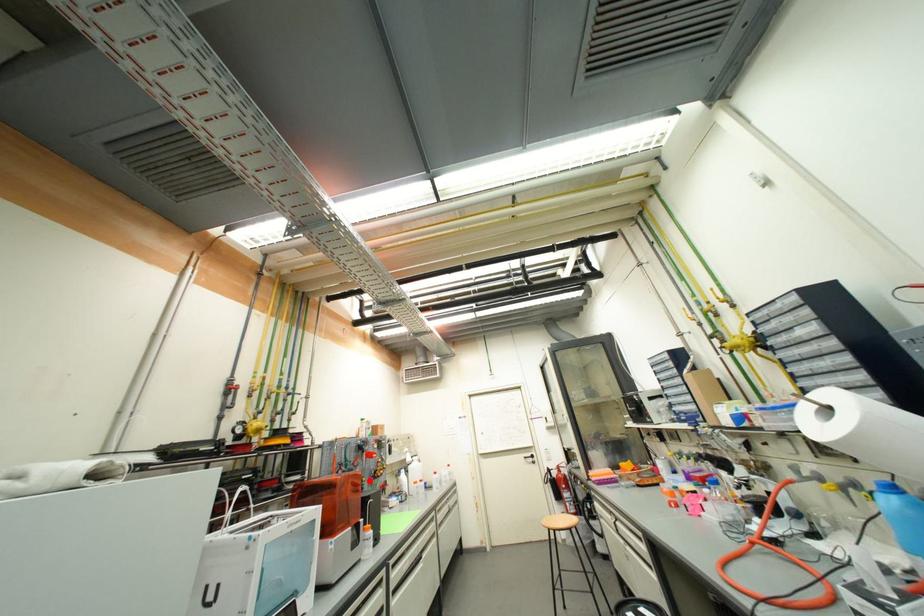
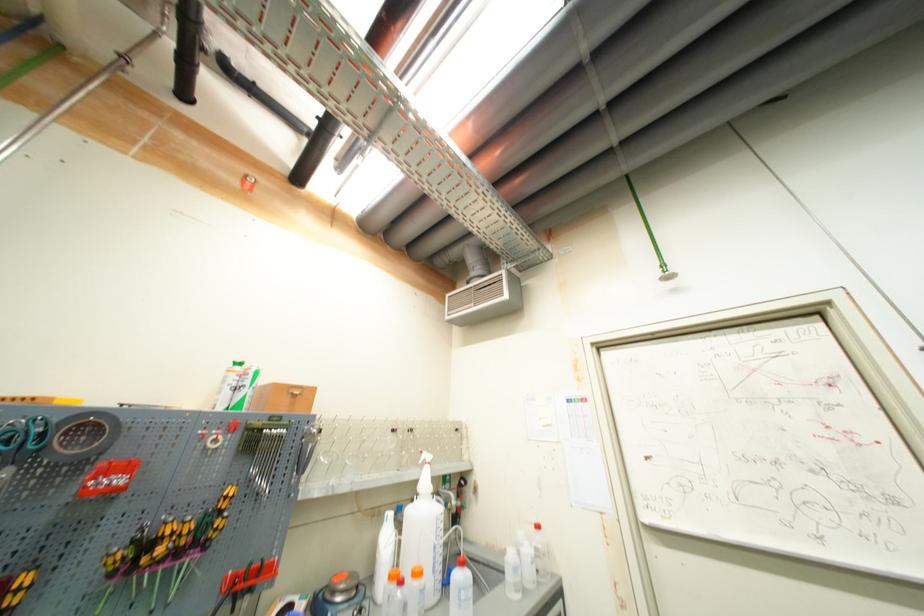
The point at the highlighted location is marked in the first image. Where is the corresponding point in the second image?

(30, 581)